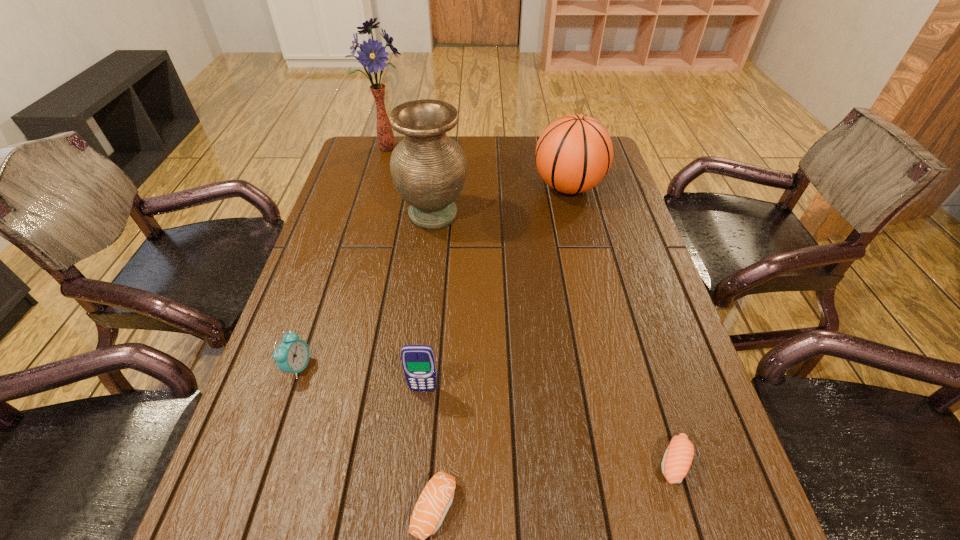
Identify the location of free region located on the front of the second tallest object. (427, 262).

Identify the location of free location located 0.320m on the left of the fifth shortest object. Image resolution: width=960 pixels, height=540 pixels. (433, 187).

This screenshot has height=540, width=960. I want to click on free space located 0.050m on the front-facing side of the fourth shortest object, so click(420, 415).

Where is `vacant space situated on the face of the fourth nearest object`? Image resolution: width=960 pixels, height=540 pixels. vacant space situated on the face of the fourth nearest object is located at coordinates (366, 367).

Identify the location of vacant space situated 0.120m on the left of the right sushi. click(x=589, y=462).

The width and height of the screenshot is (960, 540). Find the location of `flower arrangement positioned at the far edge`. flower arrangement positioned at the far edge is located at coordinates (372, 55).

Identify the location of basketball that is at the far edge. This screenshot has width=960, height=540. (574, 153).

Identify the location of flower arrangement located at the left edge. coord(372,55).

Locate an element on the screen. This screenshot has height=540, width=960. alarm clock positioned at the left edge is located at coordinates (292, 356).

This screenshot has height=540, width=960. Identify the location of basketball at the right edge. (574, 153).